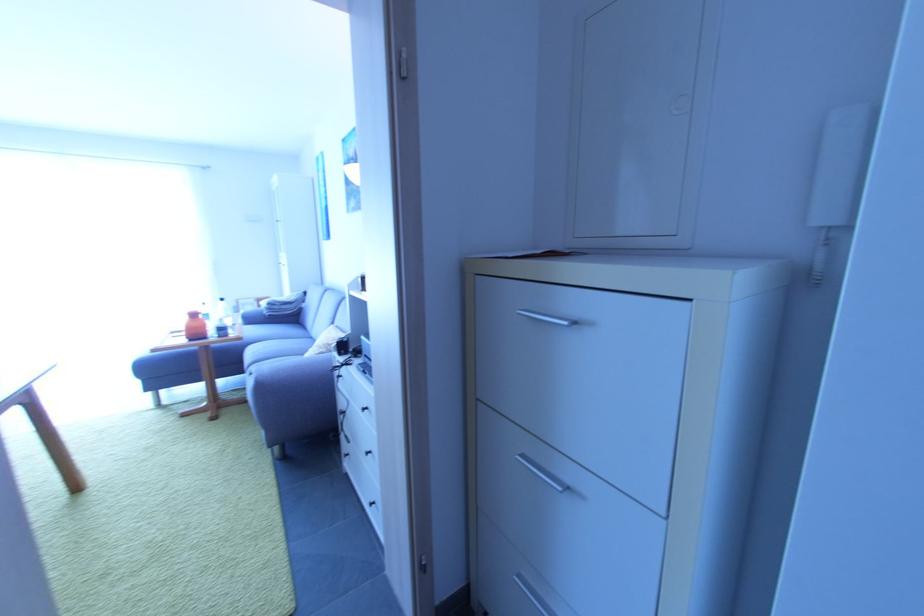
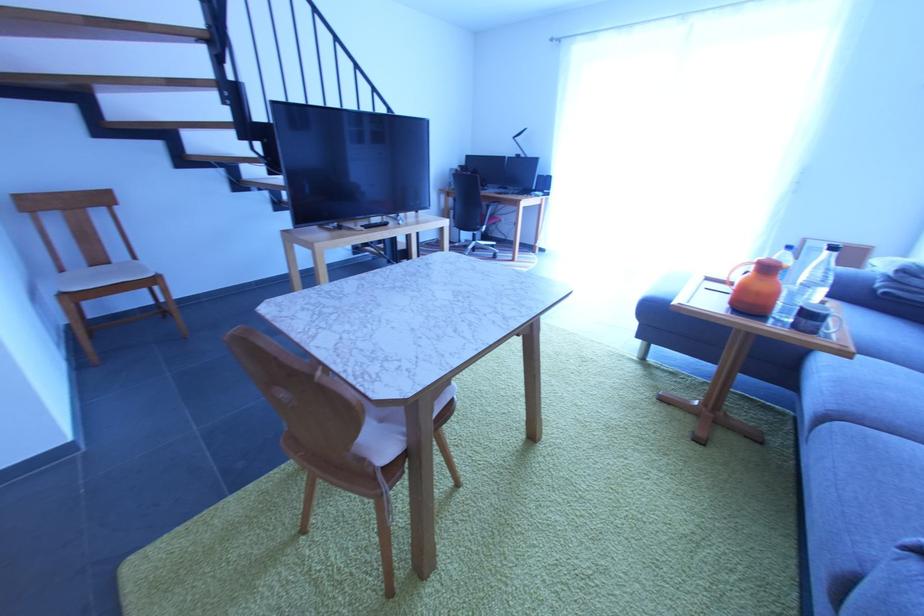
The point at (209, 329) is marked in the first image. Where is the corresponding point in the second image?

(779, 297)